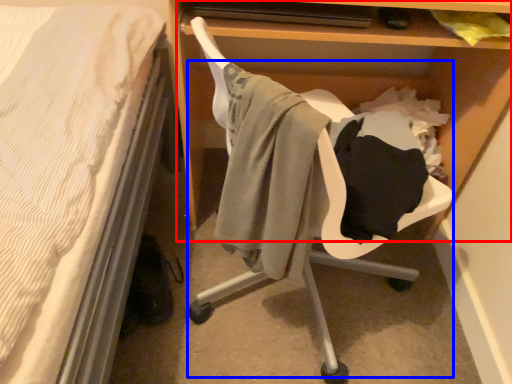
Question: Which object is further to the camera taking this photo, shelf (highlighted by a red box) or swivel chair (highlighted by a blue box)?

Choices:
 (A) shelf
 (B) swivel chair

Answer: (A)